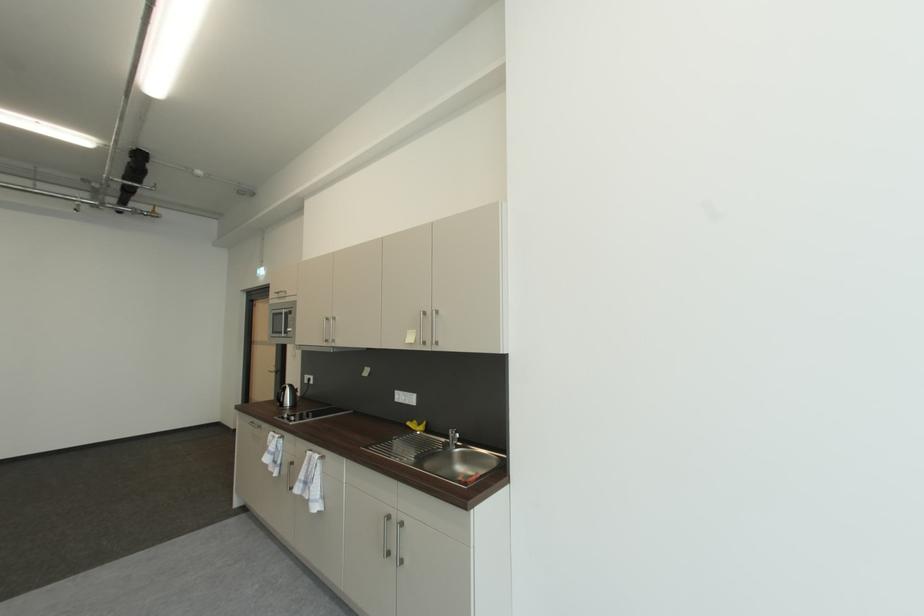
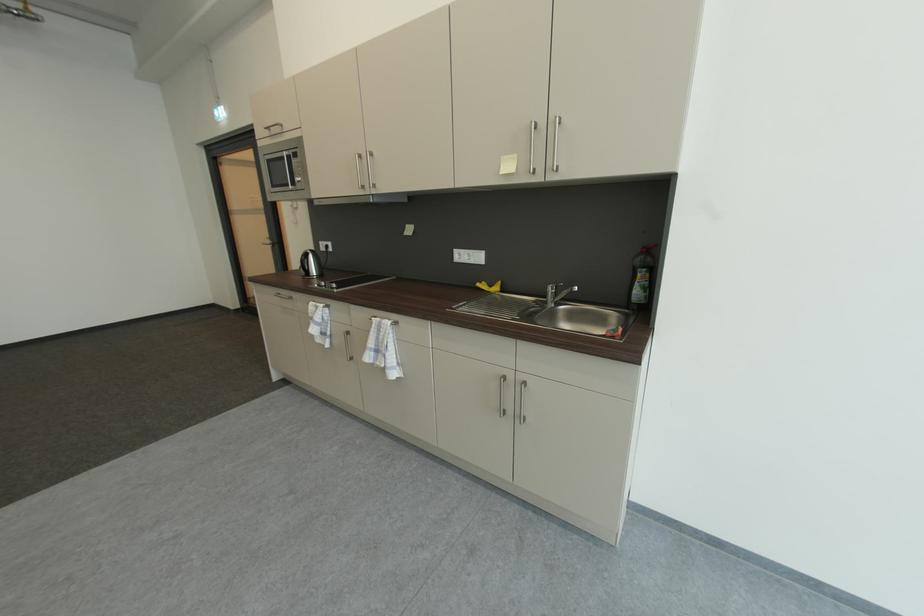
The point at (412,403) is marked in the first image. Where is the corresponding point in the second image?

(479, 262)